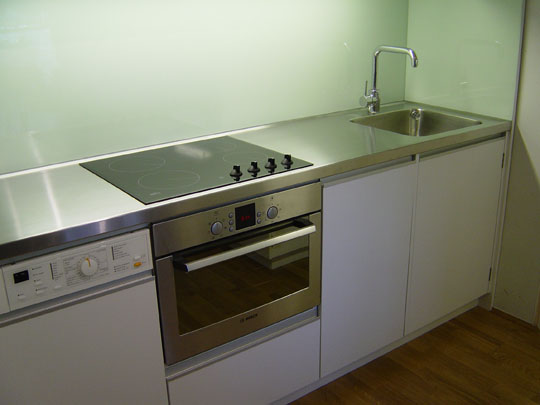
Identify the location of hinges on the right side. The height and width of the screenshot is (405, 540). (490, 276), (498, 164).